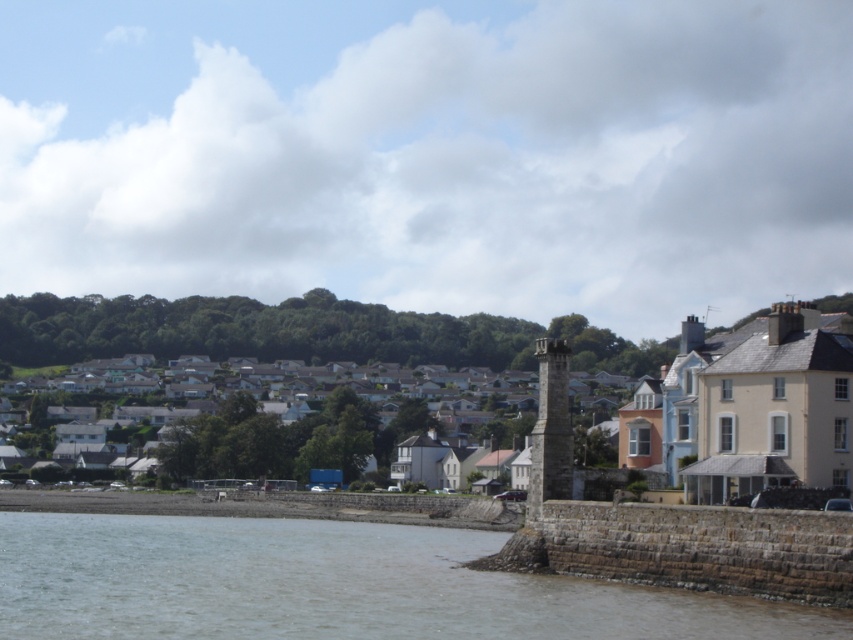
Question: Is brown stone wall at lower left below white matte houses at center?

Choices:
 (A) no
 (B) yes

Answer: (B)

Question: Which point is farther from the camera taking this photo?

Choices:
 (A) (91, 516)
 (B) (289, 461)

Answer: (B)

Question: Which point appears closest to the camera in this image?

Choices:
 (A) coord(306,298)
 (B) coord(416,634)

Answer: (B)

Question: Can you confirm if brown stone wall at lower left is positioned below white matte houses at center?

Choices:
 (A) yes
 (B) no

Answer: (A)

Question: Does brown stone wall at lower left have a larger size compared to white matte houses at center?

Choices:
 (A) no
 (B) yes

Answer: (A)